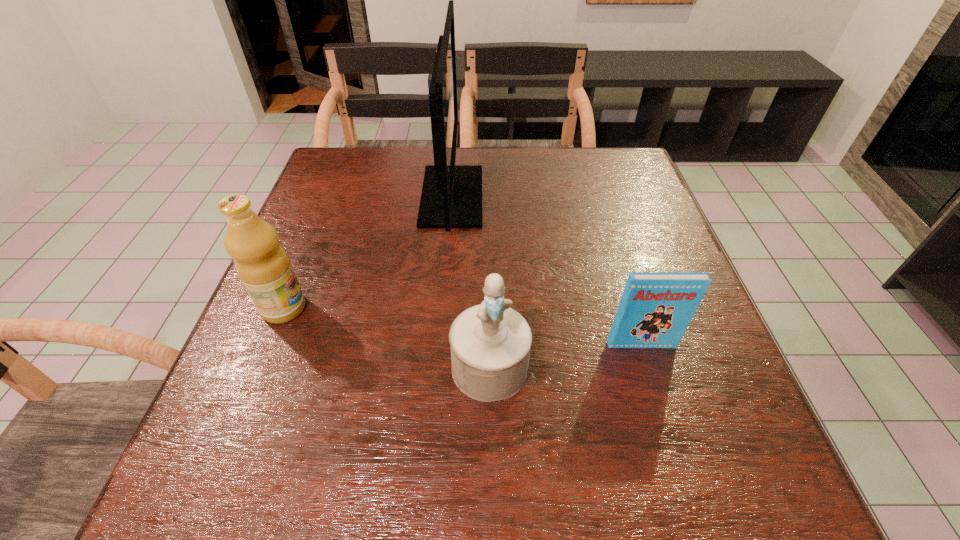
Where is `free location at the near right corner of the desktop`? This screenshot has height=540, width=960. free location at the near right corner of the desktop is located at coordinates (703, 492).

Locate an element on the screen. The image size is (960, 540). blank region between the tallest object and the shortest object is located at coordinates (546, 271).

The width and height of the screenshot is (960, 540). Identify the location of unoccupied position between the figurine and the farthest object. (470, 282).

Locate an element on the screen. This screenshot has height=540, width=960. vacant area that lies between the rightmost object and the farthest object is located at coordinates (546, 271).

Identify the location of empty location between the leftmost object and the figurine. (387, 338).

This screenshot has height=540, width=960. What are the coordinates of `unoccupied position between the figurine and the monitor` in the screenshot? It's located at (470, 282).

You are a GUI agent. You are given a task and a screenshot of the screen. Output one action in this format:
    pyautogui.click(x=<x>, y=<y>)
    Task: Click on the free space between the tallest object and the shortest object
    
    Given the screenshot: What is the action you would take?
    pyautogui.click(x=546, y=271)

The width and height of the screenshot is (960, 540). I want to click on free spot between the leftmost object and the farthest object, so click(368, 252).

The width and height of the screenshot is (960, 540). Find the location of `empty space that is in between the figurine and the shortest object`. empty space that is in between the figurine and the shortest object is located at coordinates 565,356.

Where is `unoccupied position between the third nearest object and the tallest object`? unoccupied position between the third nearest object and the tallest object is located at coordinates (368, 252).